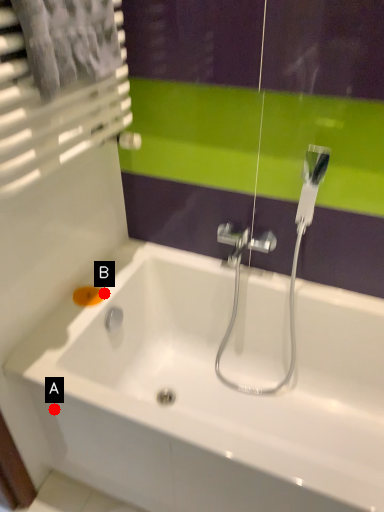
Question: Two points are circled on the image, labeled by A and B beside each circle. Among these points, which one is farthest from the camera?

Choices:
 (A) A is further
 (B) B is further

Answer: (B)